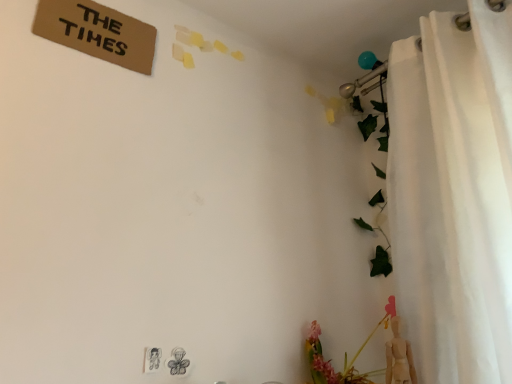
Find the location of `white fabric curtain at right`. white fabric curtain at right is located at coordinates (453, 193).

What do you see at coordinates (453, 193) in the screenshot? The width and height of the screenshot is (512, 384). I see `white fabric curtain at right` at bounding box center [453, 193].

This screenshot has height=384, width=512. In order to click on pink matte floral arrangement at lower right in this screenshot , I will do `click(331, 360)`.

Describe the element at coordinates (331, 360) in the screenshot. The image size is (512, 384). I see `pink matte floral arrangement at lower right` at that location.

Measure the distance between pink matte floral arrangement at lower right and camera.

pink matte floral arrangement at lower right and camera are 1.12 meters apart.

Where is `white fabric curtain at right`? white fabric curtain at right is located at coordinates (453, 193).

Does pink matte floral arrangement at lower right appear on the left side of white fabric curtain at right?

Yes.

Based on the photo, is pink matte floral arrangement at lower right further to camera compared to white fabric curtain at right?

Yes, the depth of pink matte floral arrangement at lower right is greater than that of white fabric curtain at right.

Which is behind, point (355, 382) or point (466, 375)?

Positioned behind is point (355, 382).

From the image's perspective, which is below, pink matte floral arrangement at lower right or white fabric curtain at right?

pink matte floral arrangement at lower right.

Consider the image. From a real-world perspective, between pink matte floral arrangement at lower right and white fabric curtain at right, who is vertically higher?

white fabric curtain at right, from a real-world perspective.

Considering the sizes of objects pink matte floral arrangement at lower right and white fabric curtain at right in the image provided, who is wider, pink matte floral arrangement at lower right or white fabric curtain at right?

white fabric curtain at right.

Considering the sizes of objects pink matte floral arrangement at lower right and white fabric curtain at right in the image provided, who is shorter, pink matte floral arrangement at lower right or white fabric curtain at right?

pink matte floral arrangement at lower right.

Between pink matte floral arrangement at lower right and white fabric curtain at right, which one has larger size?

white fabric curtain at right is bigger.

Can we say pink matte floral arrangement at lower right lies outside white fabric curtain at right?

Absolutely, pink matte floral arrangement at lower right is external to white fabric curtain at right.

Is pink matte floral arrangement at lower right not near white fabric curtain at right?

They are positioned close to each other.

Is pink matte floral arrangement at lower right oriented away from white fabric curtain at right?

pink matte floral arrangement at lower right does not have its back to white fabric curtain at right.

Can you tell me how much pink matte floral arrangement at lower right and white fabric curtain at right differ in facing direction?

The angular difference between pink matte floral arrangement at lower right and white fabric curtain at right is 89.4 degrees.

Measure the distance between pink matte floral arrangement at lower right and white fabric curtain at right.

pink matte floral arrangement at lower right is 20.43 inches away from white fabric curtain at right.

At what (x,y) coordinates should I click in order to perform the action: click on floral arrangement on the left of white fabric curtain at right. Please return your answer as a coordinate pair (x, y). This screenshot has width=512, height=384. Looking at the image, I should click on (331, 360).

Considering the relative positions of white fabric curtain at right and pink matte floral arrangement at lower right in the image provided, is white fabric curtain at right to the left or to the right of pink matte floral arrangement at lower right?

Based on their positions, white fabric curtain at right is located to the right of pink matte floral arrangement at lower right.

Which object is further away from the camera, white fabric curtain at right or pink matte floral arrangement at lower right?

pink matte floral arrangement at lower right.

Does point (474, 346) appear closer or farther from the camera than point (335, 379)?

Clearly, point (474, 346) is closer to the camera than point (335, 379).

Looking at this image, from the image's perspective, is white fabric curtain at right positioned above or below pink matte floral arrangement at lower right?

Clearly, from the image's perspective, white fabric curtain at right is above pink matte floral arrangement at lower right.

From a real-world perspective, between white fabric curtain at right and pink matte floral arrangement at lower right, who is vertically lower?

pink matte floral arrangement at lower right.

Is white fabric curtain at right wider or thinner than pink matte floral arrangement at lower right?

In the image, white fabric curtain at right appears to be wider than pink matte floral arrangement at lower right.

Is white fabric curtain at right taller than pink matte floral arrangement at lower right?

Indeed, white fabric curtain at right has a greater height compared to pink matte floral arrangement at lower right.

Which of these two, white fabric curtain at right or pink matte floral arrangement at lower right, is smaller?

Smaller between the two is pink matte floral arrangement at lower right.

Do you think white fabric curtain at right is within pink matte floral arrangement at lower right, or outside of it?

white fabric curtain at right cannot be found inside pink matte floral arrangement at lower right.

Is there a large distance between white fabric curtain at right and pink matte floral arrangement at lower right?

No, white fabric curtain at right is in close proximity to pink matte floral arrangement at lower right.

Could you tell me if white fabric curtain at right is turned towards pink matte floral arrangement at lower right?

No, white fabric curtain at right is not turned towards pink matte floral arrangement at lower right.

What's the angular difference between white fabric curtain at right and pink matte floral arrangement at lower right's facing directions?

The angle between the facing direction of white fabric curtain at right and the facing direction of pink matte floral arrangement at lower right is 89.4 degrees.

The height and width of the screenshot is (384, 512). Find the location of `floral arrangement lying below the white fabric curtain at right (from the image's perspective)`. floral arrangement lying below the white fabric curtain at right (from the image's perspective) is located at coordinates (331, 360).

There is a pink matte floral arrangement at lower right. Identify the location of curtain above it (from a real-world perspective). The height and width of the screenshot is (384, 512). (453, 193).

Identify the location of curtain on the right of pink matte floral arrangement at lower right. This screenshot has height=384, width=512. (453, 193).